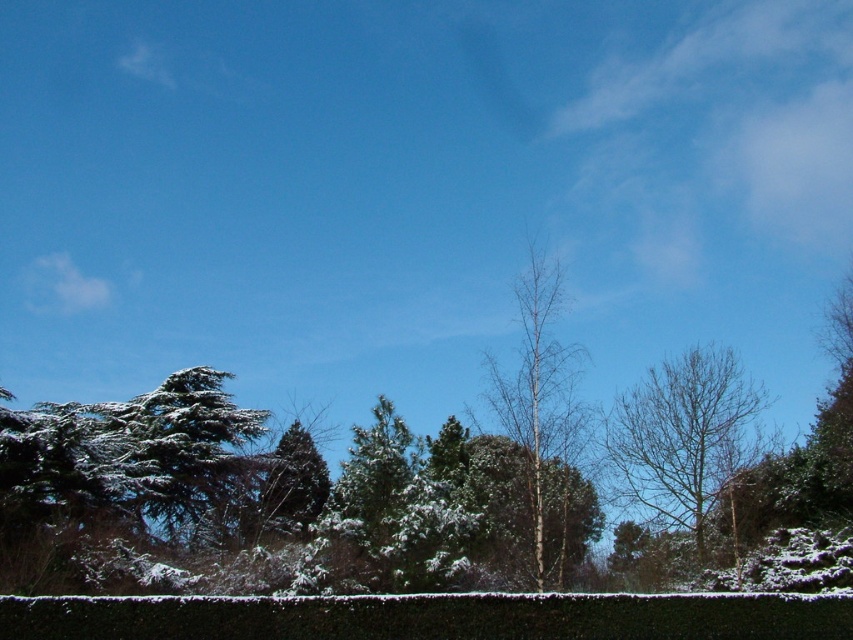
Question: Does bare branches tree at center have a lesser width compared to bare wood tree at center?

Choices:
 (A) no
 (B) yes

Answer: (B)

Question: Among these points, which one is farthest from the camera?

Choices:
 (A) (682, 525)
 (B) (543, 253)

Answer: (B)

Question: Does bare branches tree at center appear on the right side of bare wood tree at center?

Choices:
 (A) no
 (B) yes

Answer: (B)

Question: Does bare branches tree at center appear on the right side of bare wood tree at center?

Choices:
 (A) yes
 (B) no

Answer: (A)